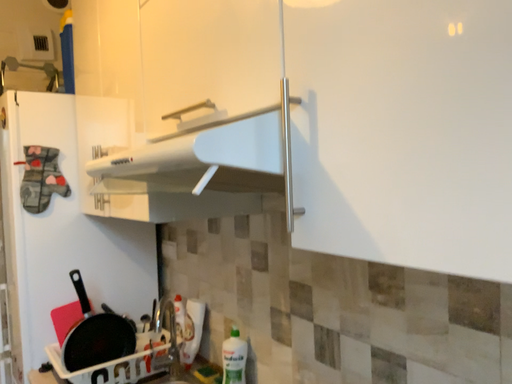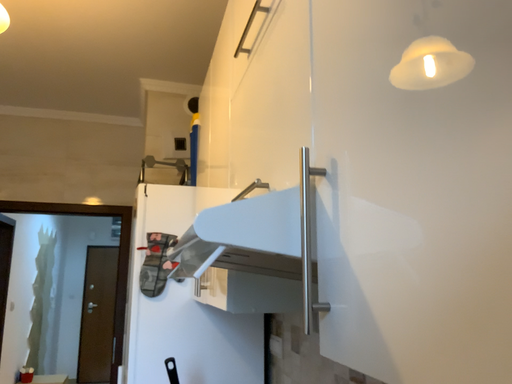
Question: Which way did the camera rotate in the video?

Choices:
 (A) rotated left
 (B) rotated right

Answer: (A)